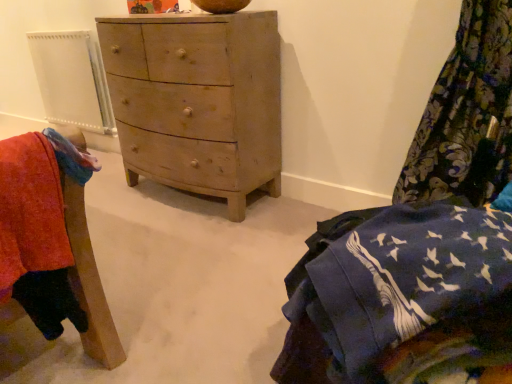
Question: Is blue cotton blanket at lower right to the left of wooden chair at lower left from the viewer's perspective?

Choices:
 (A) yes
 (B) no

Answer: (B)

Question: Can you confirm if blue cotton blanket at lower right is taller than wooden chair at lower left?

Choices:
 (A) yes
 (B) no

Answer: (A)

Question: Does blue cotton blanket at lower right have a larger size compared to wooden chair at lower left?

Choices:
 (A) yes
 (B) no

Answer: (A)

Question: Does blue cotton blanket at lower right lie in front of wooden chair at lower left?

Choices:
 (A) yes
 (B) no

Answer: (A)

Question: Can we say blue cotton blanket at lower right lies outside wooden chair at lower left?

Choices:
 (A) no
 (B) yes

Answer: (B)

Question: Does point (82, 304) appear closer or farther from the camera than point (453, 329)?

Choices:
 (A) farther
 (B) closer

Answer: (A)

Question: In terms of height, does wooden chair at lower left look taller or shorter compared to blue cotton blanket at lower right?

Choices:
 (A) tall
 (B) short

Answer: (B)

Question: Relative to blue cotton blanket at lower right, is wooden chair at lower left in front or behind?

Choices:
 (A) behind
 (B) front

Answer: (A)

Question: From the image's perspective, is wooden chair at lower left located above or below blue cotton blanket at lower right?

Choices:
 (A) below
 (B) above

Answer: (B)

Question: From the image's perspective, is wooden chair at lower left positioned above or below white plastic radiator at left?

Choices:
 (A) below
 (B) above

Answer: (A)

Question: Is wooden chair at lower left in front of or behind white plastic radiator at left in the image?

Choices:
 (A) front
 (B) behind

Answer: (A)

Question: Is wooden chair at lower left situated inside white plastic radiator at left or outside?

Choices:
 (A) inside
 (B) outside

Answer: (B)

Question: From their relative heights in the image, would you say wooden chair at lower left is taller or shorter than white plastic radiator at left?

Choices:
 (A) short
 (B) tall

Answer: (A)

Question: Is wooden chest of drawers at center bigger or smaller than wooden chair at lower left?

Choices:
 (A) small
 (B) big

Answer: (B)

Question: Would you say wooden chest of drawers at center is to the left or to the right of wooden chair at lower left in the picture?

Choices:
 (A) right
 (B) left

Answer: (A)